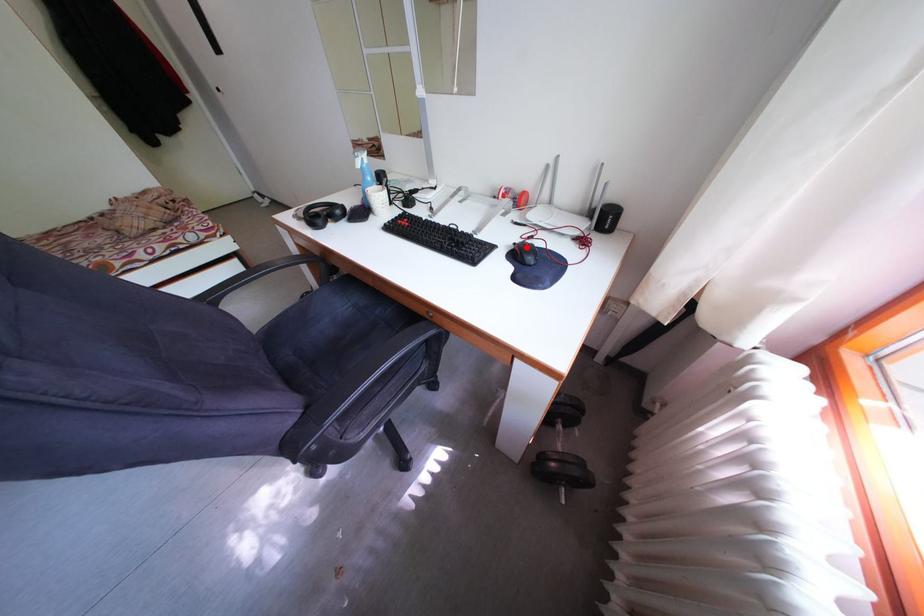
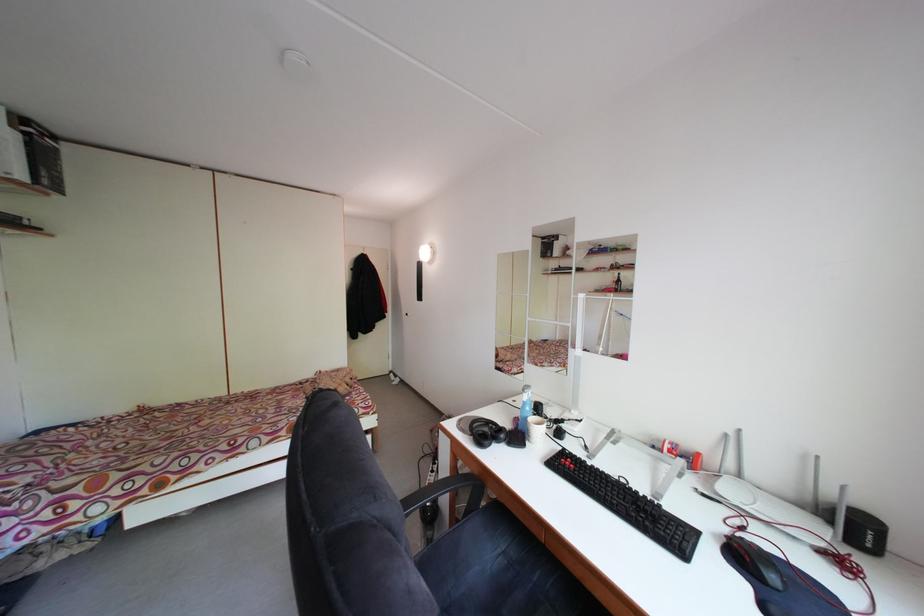
The point at the highlighted location is marked in the first image. Where is the corresponding point in the second image?

(735, 536)